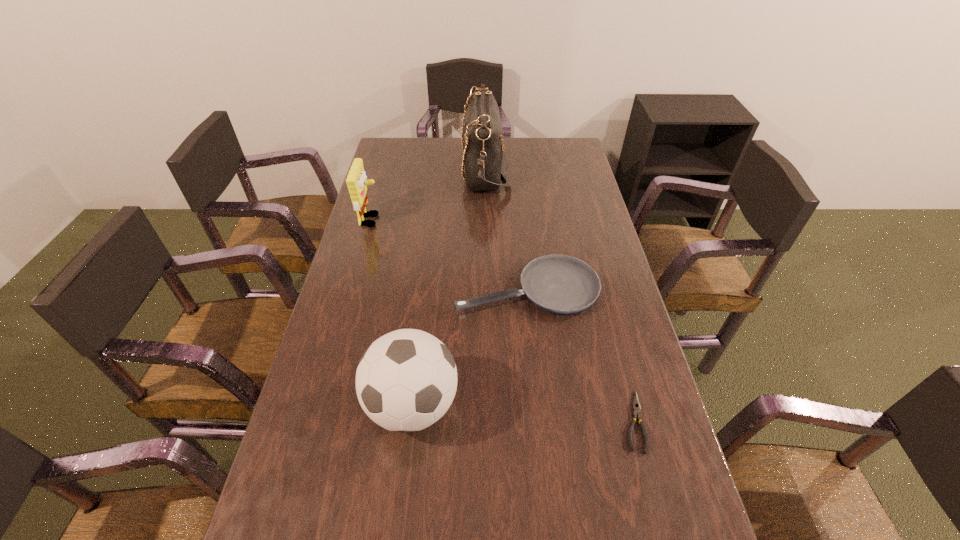
This screenshot has width=960, height=540. Find the location of `vacant area situated 0.110m at the front of the handbag with chain and zipper`. vacant area situated 0.110m at the front of the handbag with chain and zipper is located at coordinates (433, 168).

This screenshot has height=540, width=960. In order to click on vacant area situated on the right of the soccer ball in this screenshot , I will do `click(480, 405)`.

Locate an element on the screen. The height and width of the screenshot is (540, 960). vacant space situated on the face of the leftmost object is located at coordinates (480, 220).

Where is `vacant space located 0.340m on the left of the third farthest object`? The image size is (960, 540). vacant space located 0.340m on the left of the third farthest object is located at coordinates (340, 288).

Image resolution: width=960 pixels, height=540 pixels. I want to click on free spot located 0.140m on the left of the shortest object, so click(561, 421).

Locate an element on the screen. The width and height of the screenshot is (960, 540). object that is at the far edge is located at coordinates (485, 160).

The height and width of the screenshot is (540, 960). In order to click on soccer ball that is at the left edge in this screenshot , I will do `click(406, 380)`.

Where is `sponge present at the left edge`? sponge present at the left edge is located at coordinates (356, 181).

This screenshot has height=540, width=960. In order to click on frying pan that is at the right edge in this screenshot , I will do `click(561, 284)`.

At what (x,y) coordinates should I click in order to perform the action: click on pliers that is at the right edge. Please return your answer as a coordinate pair (x, y). This screenshot has width=960, height=540. Looking at the image, I should click on (636, 406).